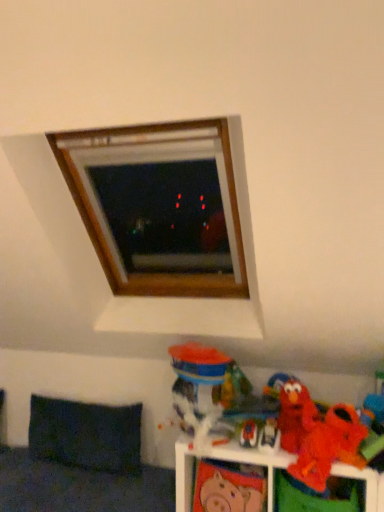
I want to click on matte plastic toy at lower right, which is the third toy from left to right, so (249, 434).

The height and width of the screenshot is (512, 384). What do you see at coordinates (269, 437) in the screenshot?
I see `matte plastic elmo at lower right, marked as the 4th toy in a right-to-left arrangement` at bounding box center [269, 437].

How much space does orange plush toy at lower right, placed as the 7th toy when sorted from left to right, occupy vertically?

orange plush toy at lower right, placed as the 7th toy when sorted from left to right, is 11.29 centimeters in height.

The width and height of the screenshot is (384, 512). I want to click on matte plastic toy at lower right, the 5th toy from the right, so click(249, 434).

Is matte plastic toy at lower right, which is the third toy from left to right, directly adjacent to orange plush toy at lower right?

No.

At what (x,y) coordinates should I click in order to perform the action: click on toy that is the 2nd one above the orange plush toy at lower right (from a real-world perspective). Please return your answer as a coordinate pair (x, y). The width and height of the screenshot is (384, 512). Looking at the image, I should click on (249, 434).

Which is more to the right, matte plastic toy at lower right, the 5th toy from the right, or orange plush toy at lower right?

orange plush toy at lower right is more to the right.

Based on the photo, from a real-world perspective, which is physically below, matte plastic toy at lower right, the 5th toy from the right, or orange plush toy at lower right?

orange plush toy at lower right, from a real-world perspective.

Measure the distance between matte red plush at lower right, which is counted as the 6th toy, starting from the left, and red plush toy at lower right, the 3th toy from the right.

They are 3.37 inches apart.

Is matte red plush at lower right, which is the 2th toy in right-to-left order, to the left of red plush toy at lower right, arranged as the 5th toy when viewed from the left, from the viewer's perspective?

In fact, matte red plush at lower right, which is the 2th toy in right-to-left order, is to the right of red plush toy at lower right, arranged as the 5th toy when viewed from the left.

From a real-world perspective, between matte red plush at lower right, which is the 2th toy in right-to-left order, and red plush toy at lower right, arranged as the 5th toy when viewed from the left, who is vertically higher?

In real-world perspective, red plush toy at lower right, arranged as the 5th toy when viewed from the left, is above.

Between matte red plush at lower right, which is the 2th toy in right-to-left order, and matte pink piggy bank at lower center, acting as the second toy starting from the left, which one is positioned behind?

matte pink piggy bank at lower center, acting as the second toy starting from the left, is behind.

Is matte pink piggy bank at lower center, the sixth toy in the right-to-left sequence, at the back of matte red plush at lower right, which is the 2th toy in right-to-left order?

No, matte red plush at lower right, which is the 2th toy in right-to-left order, is not facing the opposite direction of matte pink piggy bank at lower center, the sixth toy in the right-to-left sequence.

Locate an element on the screen. The height and width of the screenshot is (512, 384). the 4th toy counting from the right side of the matte pink piggy bank at lower center, the sixth toy in the right-to-left sequence is located at coordinates (328, 444).

Looking at the image, does matte red plush at lower right, which is counted as the 6th toy, starting from the left, seem bigger or smaller compared to matte pink piggy bank at lower center, the sixth toy in the right-to-left sequence?

Clearly, matte red plush at lower right, which is counted as the 6th toy, starting from the left, is larger in size than matte pink piggy bank at lower center, the sixth toy in the right-to-left sequence.

Considering the positions of objects dark fabric pillow at lower left and orange plush toy at lower right, placed as the 7th toy when sorted from left to right, in the image provided, who is behind, dark fabric pillow at lower left or orange plush toy at lower right, placed as the 7th toy when sorted from left to right,?

dark fabric pillow at lower left is behind.

Does dark fabric pillow at lower left have a lesser height compared to orange plush toy at lower right, marked as the 1th toy in a right-to-left arrangement?

Incorrect, the height of dark fabric pillow at lower left does not fall short of that of orange plush toy at lower right, marked as the 1th toy in a right-to-left arrangement.

Is dark fabric pillow at lower left facing towards orange plush toy at lower right, marked as the 1th toy in a right-to-left arrangement?

No, dark fabric pillow at lower left is not oriented towards orange plush toy at lower right, marked as the 1th toy in a right-to-left arrangement.

From a real-world perspective, who is located lower, translucent plastic cup at lower center, positioned as the seventh toy in right-to-left order, or matte pink piggy bank at lower center, acting as the second toy starting from the left?

matte pink piggy bank at lower center, acting as the second toy starting from the left, from a real-world perspective.

Is translucent plastic cup at lower center, positioned as the seventh toy in right-to-left order, spatially inside matte pink piggy bank at lower center, acting as the second toy starting from the left, or outside of it?

translucent plastic cup at lower center, positioned as the seventh toy in right-to-left order, is located beyond the bounds of matte pink piggy bank at lower center, acting as the second toy starting from the left.

Considering the relative positions of translucent plastic cup at lower center, which ranks as the 1th toy in left-to-right order, and matte pink piggy bank at lower center, acting as the second toy starting from the left, in the image provided, is translucent plastic cup at lower center, which ranks as the 1th toy in left-to-right order, to the left or to the right of matte pink piggy bank at lower center, acting as the second toy starting from the left,?

translucent plastic cup at lower center, which ranks as the 1th toy in left-to-right order, is positioned on matte pink piggy bank at lower center, acting as the second toy starting from the left,'s left side.

From the image's perspective, which one is positioned higher, matte plastic elmo at lower right, the fourth toy positioned from the left, or matte pink piggy bank at lower center, acting as the second toy starting from the left?

matte plastic elmo at lower right, the fourth toy positioned from the left, is shown above in the image.

Could you measure the distance between matte plastic elmo at lower right, marked as the 4th toy in a right-to-left arrangement, and matte pink piggy bank at lower center, the sixth toy in the right-to-left sequence?

matte plastic elmo at lower right, marked as the 4th toy in a right-to-left arrangement, and matte pink piggy bank at lower center, the sixth toy in the right-to-left sequence, are 9.19 inches apart from each other.

Is matte plastic elmo at lower right, the fourth toy positioned from the left, to the right of matte pink piggy bank at lower center, acting as the second toy starting from the left, from the viewer's perspective?

Yes.

Which is closer, (274, 438) or (263, 511)?

Point (274, 438) appears to be closer to the viewer than point (263, 511).

From the image's perspective, count 1st toys downward from the matte red plush at lower right, which is the 2th toy in right-to-left order, and point to it. Please provide its 2D coordinates.

[(269, 437)]

Is matte plastic elmo at lower right, marked as the 4th toy in a right-to-left arrangement, located outside matte red plush at lower right, which is the 2th toy in right-to-left order?

Yes, matte plastic elmo at lower right, marked as the 4th toy in a right-to-left arrangement, is located beyond the bounds of matte red plush at lower right, which is the 2th toy in right-to-left order.

Are matte plastic elmo at lower right, the fourth toy positioned from the left, and matte red plush at lower right, which is the 2th toy in right-to-left order, beside each other?

They are not placed beside each other.

Locate an element on the screen. The height and width of the screenshot is (512, 384). shelf below the matte plastic toy at lower right, the 5th toy from the right (from a real-world perspective) is located at coordinates (252, 461).

Find the location of a particular element. The width and height of the screenshot is (384, 512). toy that is the 1st one when counting rightward from the red plush toy at lower right, arranged as the 5th toy when viewed from the left is located at coordinates (328, 444).

From the image, which object appears to be farther from dark fabric pillow at lower left, orange plush toy at lower right, marked as the 1th toy in a right-to-left arrangement, or matte pink piggy bank at lower center, acting as the second toy starting from the left?

The object further to dark fabric pillow at lower left is orange plush toy at lower right, marked as the 1th toy in a right-to-left arrangement.

When comparing their distances from matte pink piggy bank at lower center, the sixth toy in the right-to-left sequence, does dark fabric pillow at lower left or orange plush toy at lower right seem closer?

Among the two, orange plush toy at lower right is located nearer to matte pink piggy bank at lower center, the sixth toy in the right-to-left sequence.

When comparing their distances from matte red plush at lower right, which is the 2th toy in right-to-left order, does orange plush toy at lower right, placed as the 7th toy when sorted from left to right, or translucent plastic cup at lower center, positioned as the seventh toy in right-to-left order, seem closer?

Based on the image, orange plush toy at lower right, placed as the 7th toy when sorted from left to right, appears to be nearer to matte red plush at lower right, which is the 2th toy in right-to-left order.

Based on the photo, looking at the image, which one is located closer to matte plastic elmo at lower right, the fourth toy positioned from the left, dark fabric pillow at lower left or orange plush toy at lower right?

orange plush toy at lower right lies closer to matte plastic elmo at lower right, the fourth toy positioned from the left, than the other object.

Which object lies nearer to the anchor point matte plastic toy at lower right, which is the third toy from left to right, matte red plush at lower right, which is counted as the 6th toy, starting from the left, or translucent plastic cup at lower center, positioned as the seventh toy in right-to-left order?

translucent plastic cup at lower center, positioned as the seventh toy in right-to-left order, is positioned closer to the anchor matte plastic toy at lower right, which is the third toy from left to right.

Estimate the real-world distances between objects in this image. Which object is closer to matte plastic elmo at lower right, marked as the 4th toy in a right-to-left arrangement, matte red plush at lower right, which is the 2th toy in right-to-left order, or dark fabric pillow at lower left?

The object closer to matte plastic elmo at lower right, marked as the 4th toy in a right-to-left arrangement, is matte red plush at lower right, which is the 2th toy in right-to-left order.

When comparing their distances from matte red plush at lower right, which is the 2th toy in right-to-left order, does orange plush toy at lower right, placed as the 7th toy when sorted from left to right, or matte plastic elmo at lower right, the fourth toy positioned from the left, seem closer?

The object closer to matte red plush at lower right, which is the 2th toy in right-to-left order, is orange plush toy at lower right, placed as the 7th toy when sorted from left to right.

Looking at the image, which one is located further to orange plush toy at lower right, dark fabric pillow at lower left or matte red plush at lower right, which is counted as the 6th toy, starting from the left?

dark fabric pillow at lower left lies further to orange plush toy at lower right than the other object.

Find the location of a particular element. shelf located between dark fabric pillow at lower left and red plush toy at lower right, the 3th toy from the right, in the left-right direction is located at coordinates (252, 461).

What are the coordinates of `toy situated between matte plastic toy at lower right, which is the third toy from left to right, and red plush toy at lower right, the 3th toy from the right, from left to right` in the screenshot? It's located at (269, 437).

Locate an element on the screen. Image resolution: width=384 pixels, height=512 pixels. shelf between matte pink piggy bank at lower center, acting as the second toy starting from the left, and orange plush toy at lower right, placed as the 7th toy when sorted from left to right, from left to right is located at coordinates (252, 461).

The image size is (384, 512). Find the location of `shelf between matte plastic elmo at lower right, the fourth toy positioned from the left, and orange plush toy at lower right, marked as the 1th toy in a right-to-left arrangement, from left to right`. shelf between matte plastic elmo at lower right, the fourth toy positioned from the left, and orange plush toy at lower right, marked as the 1th toy in a right-to-left arrangement, from left to right is located at coordinates (252, 461).